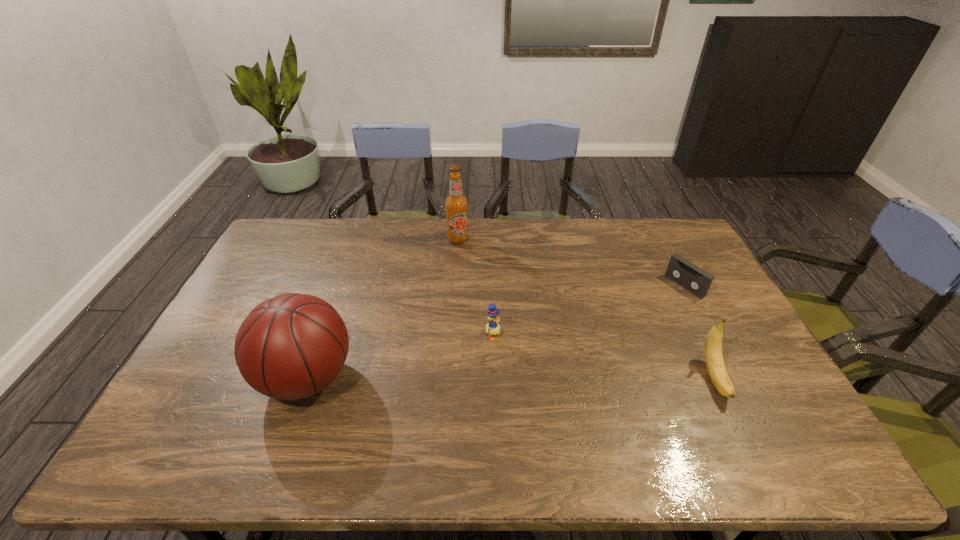
I want to click on banana present at the near edge, so click(713, 345).

Locate an element on the screen. banana situated at the right edge is located at coordinates (713, 345).

Locate an element on the screen. The width and height of the screenshot is (960, 540). videotape positioned at the right edge is located at coordinates (681, 271).

Image resolution: width=960 pixels, height=540 pixels. Find the location of `object positioned at the near right corner`. object positioned at the near right corner is located at coordinates (713, 345).

This screenshot has width=960, height=540. In the image, there is a desktop. Identify the location of vacant space at the far edge. (633, 255).

Where is `free space at the near edge`? free space at the near edge is located at coordinates (304, 415).

Find the location of a particular element. Image resolution: width=960 pixels, height=540 pixels. free location at the far left corner of the desktop is located at coordinates (299, 234).

Where is `vacant area between the duckling and the fourth object from right to left`? The height and width of the screenshot is (540, 960). vacant area between the duckling and the fourth object from right to left is located at coordinates (475, 287).

Locate an element on the screen. The image size is (960, 540). vacant region between the fourth object from right to left and the leftmost object is located at coordinates (382, 308).

This screenshot has height=540, width=960. What are the coordinates of `free spot between the third object from left to right and the banana` in the screenshot? It's located at (604, 356).